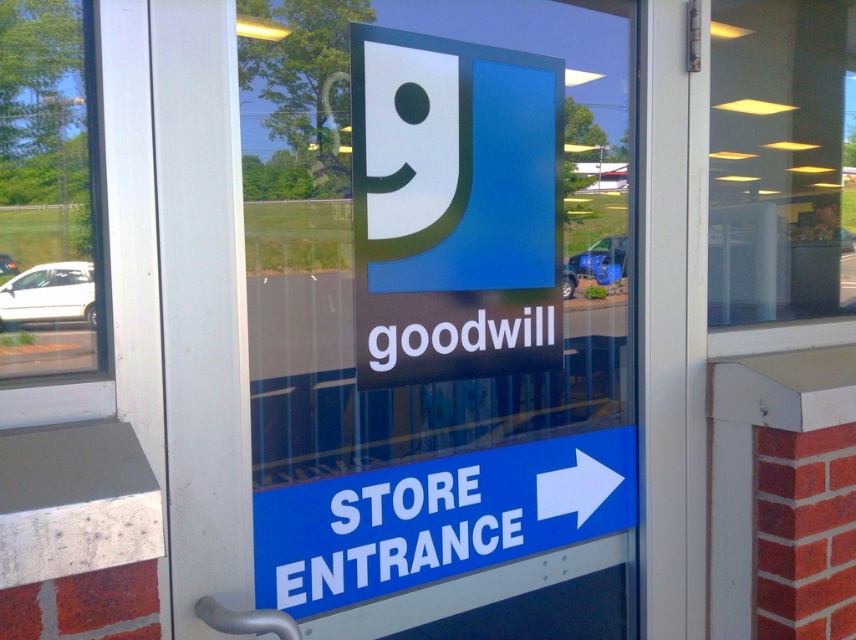
Measure the distance between matte plastic sign at center and white plastic arrow at right.

46.21 centimeters

Looking at this image, is matte plastic sign at center above white plastic arrow at right?

Indeed, matte plastic sign at center is positioned over white plastic arrow at right.

Which is behind, point (526, 74) or point (575, 486)?

Point (575, 486)

Locate an element on the screen. This screenshot has height=640, width=856. matte plastic sign at center is located at coordinates (453, 208).

Does transparent glass door at center appear over transparent glass window at center?

No, transparent glass door at center is not above transparent glass window at center.

Who is positioned more to the left, transparent glass door at center or transparent glass window at center?

Positioned to the left is transparent glass door at center.

Where is `transparent glass door at center`? The image size is (856, 640). transparent glass door at center is located at coordinates (431, 294).

Image resolution: width=856 pixels, height=640 pixels. I want to click on transparent glass door at center, so click(x=431, y=294).

Locate an element on the screen. The height and width of the screenshot is (640, 856). transparent glass window at center is located at coordinates (782, 160).

Between point (795, 220) and point (28, 228), which one is positioned in front?

Point (28, 228) is in front.

Identify the location of transparent glass window at center. (782, 160).